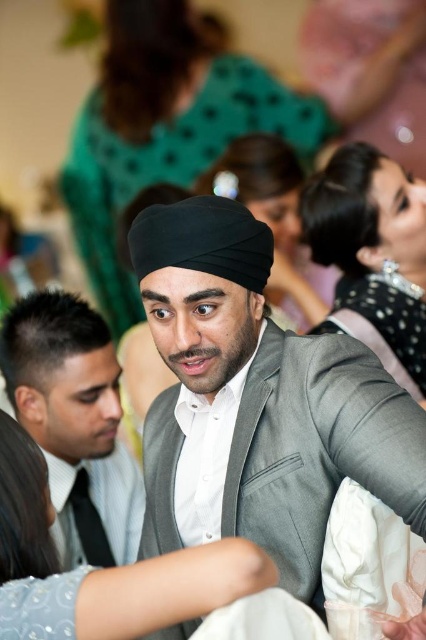
You are at a wedding and see the matte black turban at center and the matte gray suit at center. Which one is positioned higher in the image?

The matte black turban at center is positioned higher than the matte gray suit at center.

You are a photographer at the event and need to frame a closeup shot focusing on both the matte black turban at center and the matte gray suit at center. Given their widths, which object should be placed on the left side of the frame to ensure both fit horizontally?

The matte black turban at center is wider than the matte gray suit at center. To fit both horizontally, place the wider matte black turban at center on the left side of the frame, allowing space for the narrower matte gray suit at center on the right.